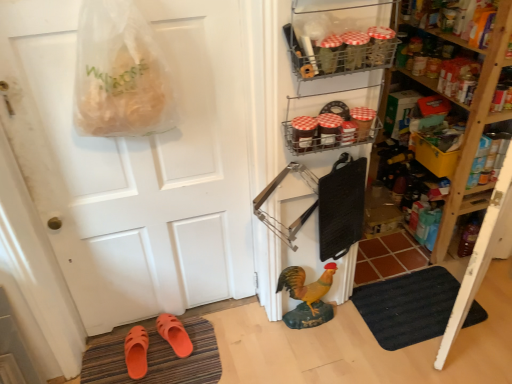
Question: Is metallic wire rack at upper center, acting as the 2th shelf starting from the back, looking in the opposite direction of metallic wire rack at upper right, the third shelf viewed from the back?

Choices:
 (A) yes
 (B) no

Answer: (B)

Question: Is metallic wire rack at upper center, acting as the 2th shelf starting from the back, not within metallic wire rack at upper right, the first shelf in the left-to-right sequence?

Choices:
 (A) yes
 (B) no

Answer: (A)

Question: Is metallic wire rack at upper center, acting as the 2th shelf starting from the back, to the right of metallic wire rack at upper right, the first shelf in the left-to-right sequence, from the viewer's perspective?

Choices:
 (A) yes
 (B) no

Answer: (A)

Question: From a real-world perspective, is metallic wire rack at upper center, marked as the 2th shelf in a front-to-back arrangement, positioned under metallic wire rack at upper right, the third shelf viewed from the back, based on gravity?

Choices:
 (A) no
 (B) yes

Answer: (B)

Question: From a real-world perspective, is metallic wire rack at upper center, the 2th shelf positioned from the right, over metallic wire rack at upper right, which is the 3th shelf from right to left?

Choices:
 (A) yes
 (B) no

Answer: (B)

Question: Is point (479, 24) closer or farther from the camera than point (346, 107)?

Choices:
 (A) farther
 (B) closer

Answer: (A)

Question: Is wooden shelves at right, which is counted as the first shelf, starting from the right, bigger or smaller than metallic wire rack at upper center, which is the second shelf from left to right?

Choices:
 (A) small
 (B) big

Answer: (B)

Question: Visually, is wooden shelves at right, marked as the first shelf in a back-to-front arrangement, positioned to the left or to the right of metallic wire rack at upper center, acting as the 2th shelf starting from the back?

Choices:
 (A) left
 (B) right

Answer: (B)

Question: Considering their positions, is wooden shelves at right, which appears as the third shelf when viewed from the left, located in front of or behind metallic wire rack at upper center, acting as the 2th shelf starting from the back?

Choices:
 (A) front
 (B) behind

Answer: (B)

Question: From a real-world perspective, is orange rubber doormat at lower left, positioned as the second doormat in right-to-left order, positioned above or below clear plastic grocery bag at upper left?

Choices:
 (A) below
 (B) above

Answer: (A)

Question: Is orange rubber doormat at lower left, positioned as the second doormat in right-to-left order, taller or shorter than clear plastic grocery bag at upper left?

Choices:
 (A) short
 (B) tall

Answer: (A)

Question: Is orange rubber doormat at lower left, arranged as the first doormat when viewed from the left, to the left or to the right of clear plastic grocery bag at upper left in the image?

Choices:
 (A) left
 (B) right

Answer: (A)

Question: Is orange rubber doormat at lower left, positioned as the second doormat in right-to-left order, inside or outside of clear plastic grocery bag at upper left?

Choices:
 (A) outside
 (B) inside

Answer: (A)

Question: From the image's perspective, is white matte door at center above or below metallic wire rack at upper center, the 2th shelf positioned from the right?

Choices:
 (A) below
 (B) above

Answer: (A)

Question: Looking at their shapes, would you say white matte door at center is wider or thinner than metallic wire rack at upper center, acting as the 2th shelf starting from the back?

Choices:
 (A) thin
 (B) wide

Answer: (A)